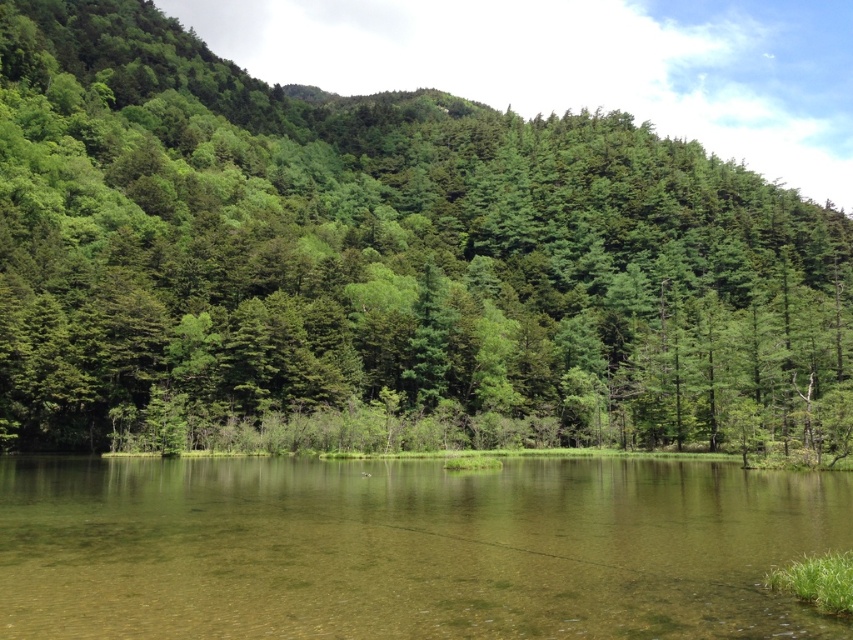
Question: Does green matte tree at center have a greater width compared to clear water at center?

Choices:
 (A) yes
 (B) no

Answer: (A)

Question: Which point is farther to the camera?

Choices:
 (A) clear water at center
 (B) green matte tree at center

Answer: (B)

Question: Can you confirm if green matte tree at center is thinner than clear water at center?

Choices:
 (A) yes
 (B) no

Answer: (B)

Question: Which point appears closest to the camera in this image?

Choices:
 (A) (618, 513)
 (B) (293, 253)

Answer: (A)

Question: Can you confirm if green matte tree at center is positioned to the left of clear water at center?

Choices:
 (A) yes
 (B) no

Answer: (B)

Question: Which point appears farthest from the camera in this image?

Choices:
 (A) (819, 380)
 (B) (624, 554)

Answer: (A)